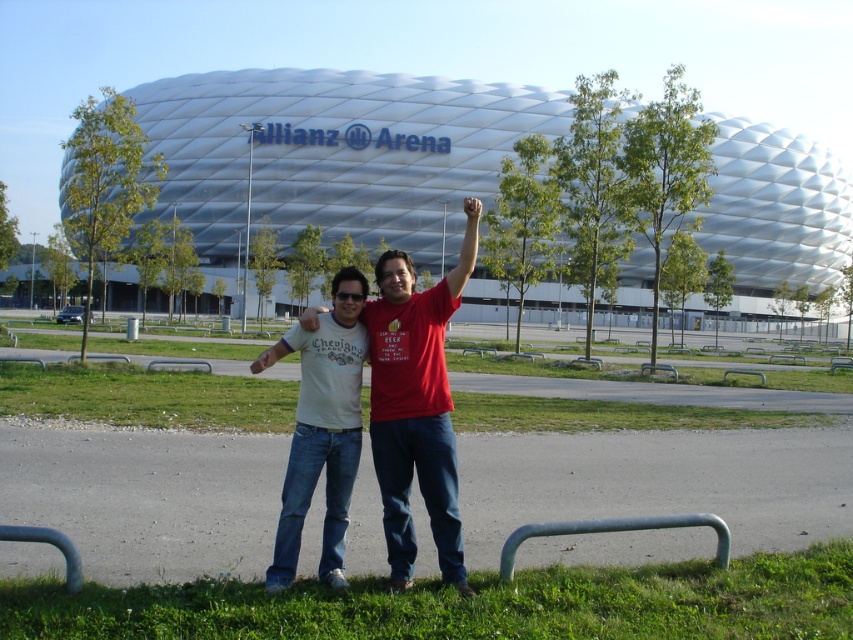
Question: Which point appears farthest from the camera in this image?

Choices:
 (A) (453, 474)
 (B) (318, 330)

Answer: (B)

Question: Is matte red t-shirt at center behind light beige cotton t-shirt at center?

Choices:
 (A) no
 (B) yes

Answer: (B)

Question: Which object appears closest to the camera in this image?

Choices:
 (A) matte red t-shirt at center
 (B) light beige cotton t-shirt at center

Answer: (B)

Question: Is matte red t-shirt at center thinner than light beige cotton t-shirt at center?

Choices:
 (A) no
 (B) yes

Answer: (A)

Question: Does matte red t-shirt at center lie behind light beige cotton t-shirt at center?

Choices:
 (A) yes
 (B) no

Answer: (A)